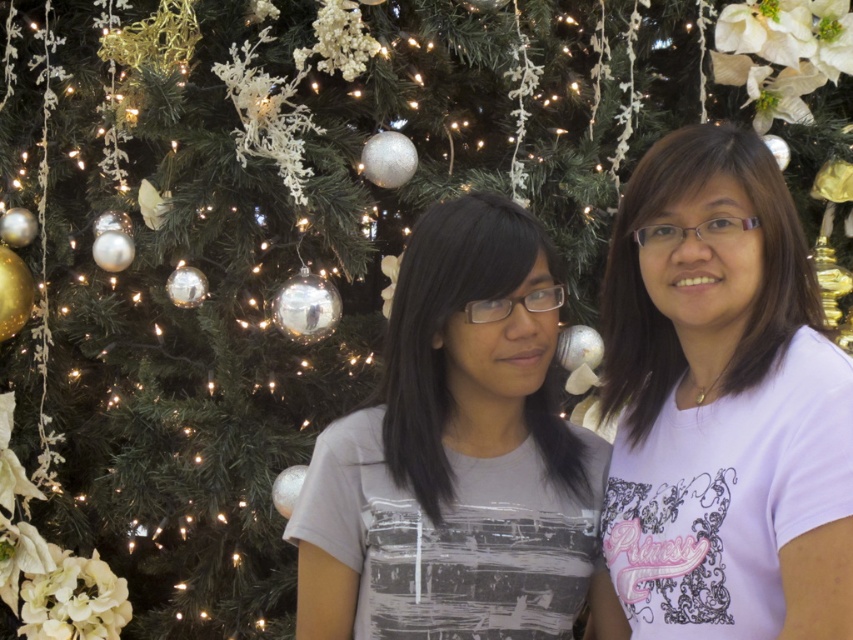
Question: Considering the relative positions of white matte shirt at right and gray matte shirt at center in the image provided, where is white matte shirt at right located with respect to gray matte shirt at center?

Choices:
 (A) right
 (B) left

Answer: (A)

Question: From the image, what is the correct spatial relationship of white matte shirt at right in relation to gray matte shirt at center?

Choices:
 (A) below
 (B) above

Answer: (B)

Question: Which of the following is the farthest from the observer?

Choices:
 (A) gray matte shirt at center
 (B) white matte shirt at right

Answer: (A)

Question: Is white matte shirt at right bigger than gray matte shirt at center?

Choices:
 (A) no
 (B) yes

Answer: (B)

Question: Which of the following is the closest to the observer?

Choices:
 (A) (683, 616)
 (B) (361, 474)

Answer: (A)